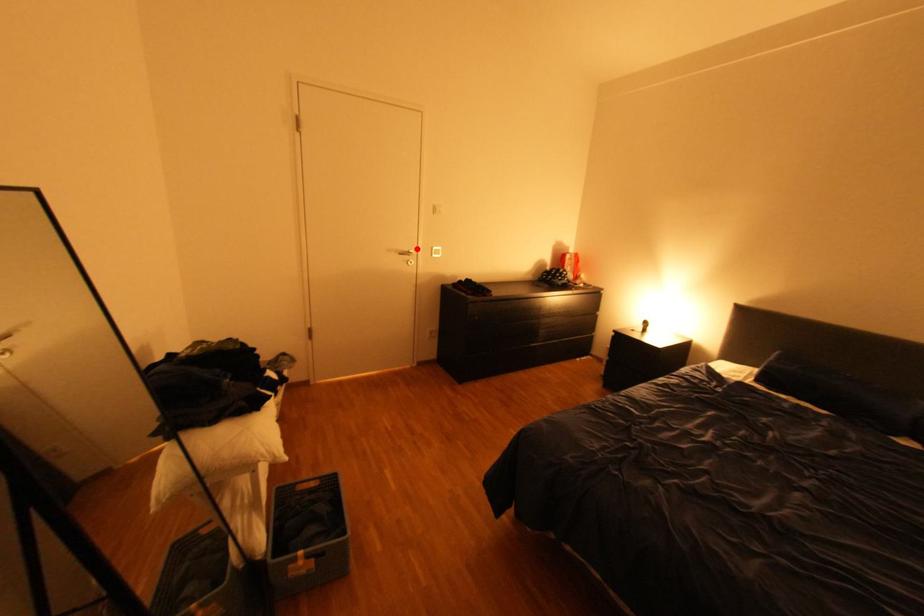
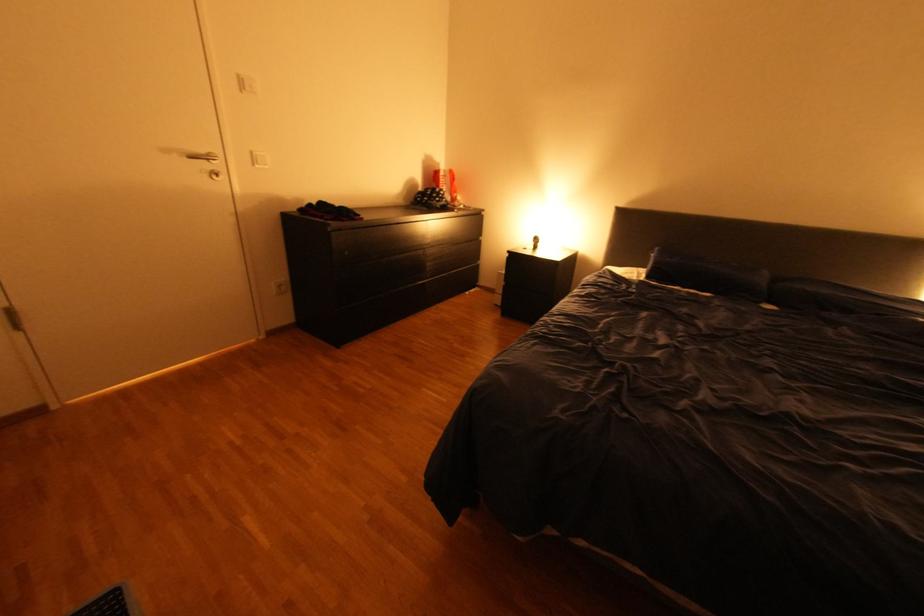
Find the pixel in the second image that matches the highlighted location in the first image.

(213, 151)